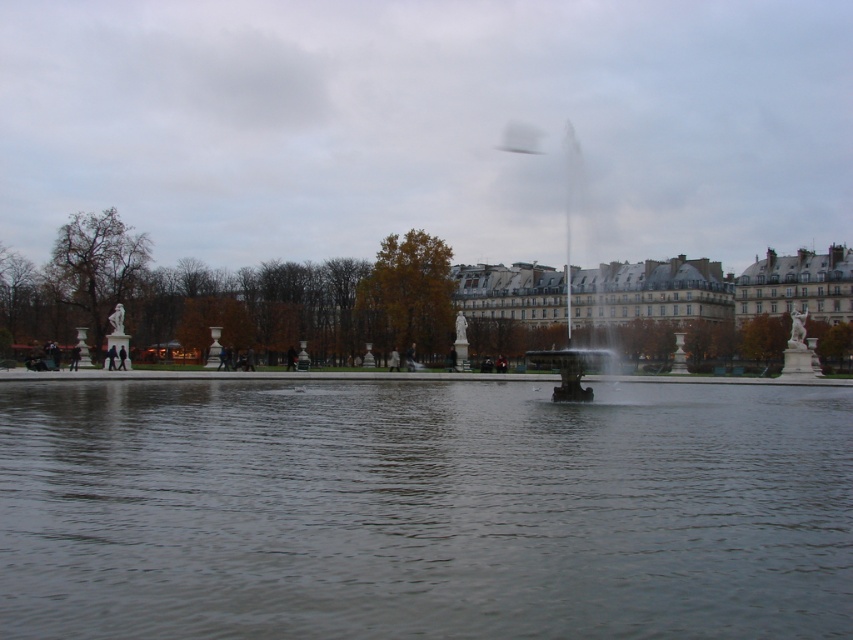
Question: Among these objects, which one is nearest to the camera?

Choices:
 (A) transparent water at center
 (B) polished bronze fountain at center

Answer: (A)

Question: Can you confirm if transparent water at center is positioned above polished bronze fountain at center?

Choices:
 (A) yes
 (B) no

Answer: (B)

Question: Can you confirm if transparent water at center is positioned to the right of polished bronze fountain at center?

Choices:
 (A) yes
 (B) no

Answer: (B)

Question: Does transparent water at center have a lesser width compared to polished bronze fountain at center?

Choices:
 (A) no
 (B) yes

Answer: (A)